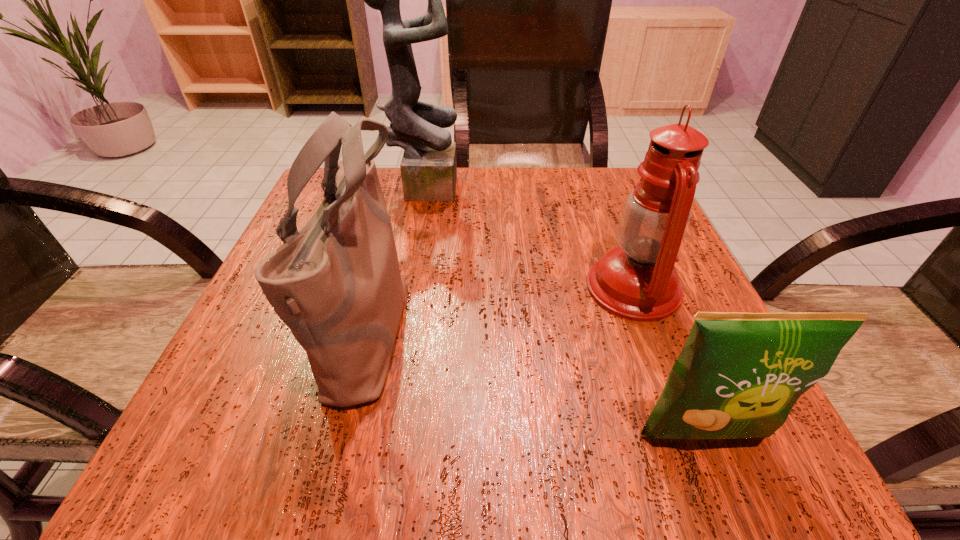
The height and width of the screenshot is (540, 960). Identify the location of crisp (potato chip) that is positioned at the near edge. (738, 375).

Locate an element on the screen. This screenshot has width=960, height=540. object at the left edge is located at coordinates (336, 283).

You are a GUI agent. You are given a task and a screenshot of the screen. Output one action in this format:
    pyautogui.click(x=<x>, y=<y>)
    Task: Click on the oil lamp that is at the right edge
    The height and width of the screenshot is (540, 960).
    Given the screenshot: What is the action you would take?
    pyautogui.click(x=637, y=281)

Image resolution: width=960 pixels, height=540 pixels. I want to click on crisp (potato chip) that is at the right edge, so click(738, 375).

I want to click on object that is at the near left corner, so click(336, 283).

Where is `object present at the near right corner`? Image resolution: width=960 pixels, height=540 pixels. object present at the near right corner is located at coordinates (738, 375).

The width and height of the screenshot is (960, 540). In the image, there is a desktop. Identify the location of free space at the far edge. (410, 213).

This screenshot has height=540, width=960. In order to click on vacant area at the near edge in this screenshot , I will do `click(637, 458)`.

What are the coordinates of `blank space at the right edge` in the screenshot? It's located at (691, 268).

At what (x,y) coordinates should I click in order to perform the action: click on blank area at the far right corner. Please return your answer as a coordinate pair (x, y). Image resolution: width=960 pixels, height=540 pixels. Looking at the image, I should click on (601, 168).